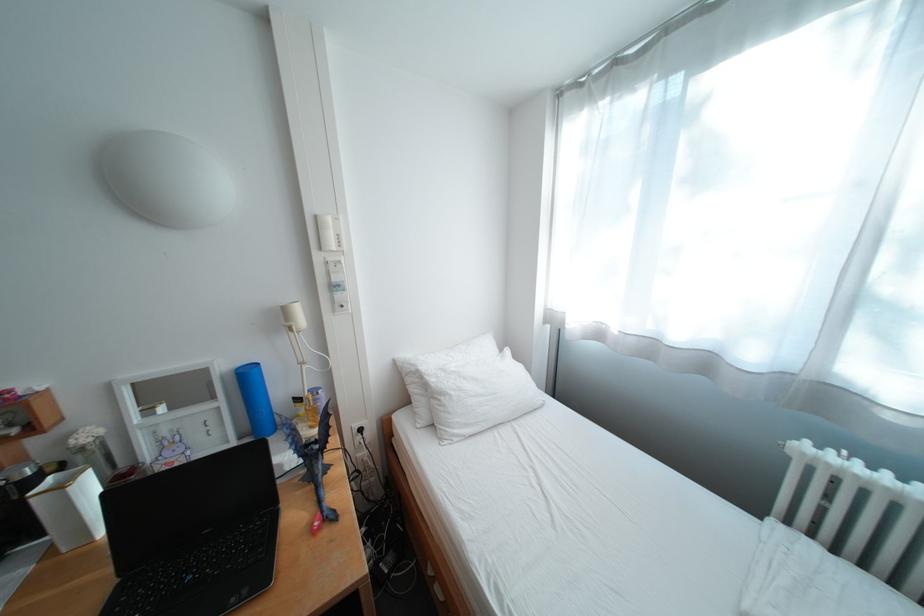
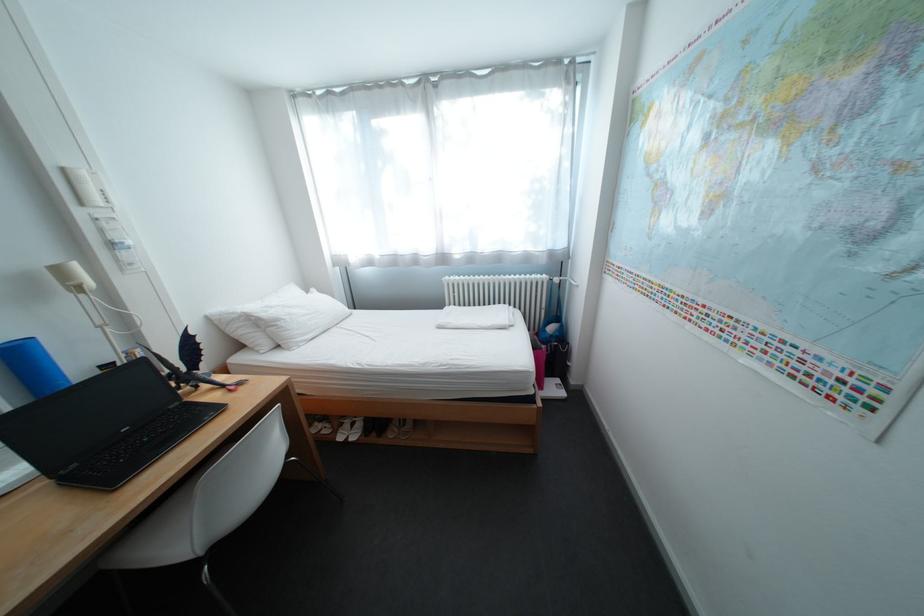
Where in the second image is the point corresponding to point (456, 397) from the first image?

(292, 322)